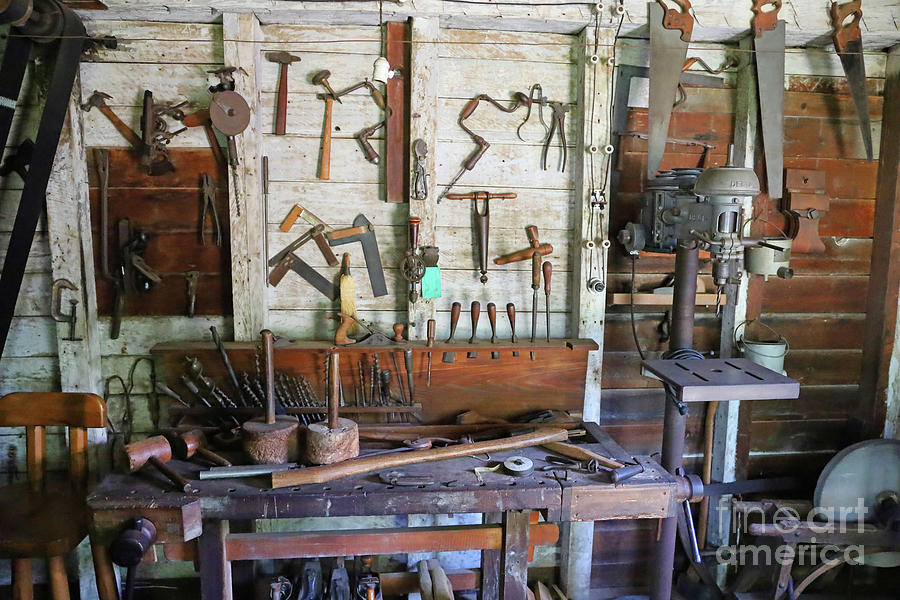
Identify the location of wood beams. (626, 376), (792, 423).